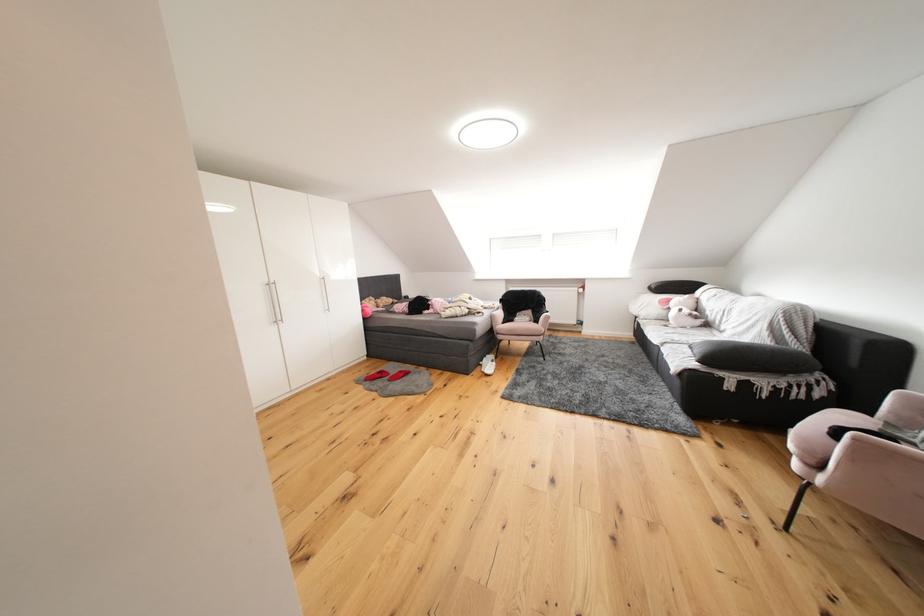
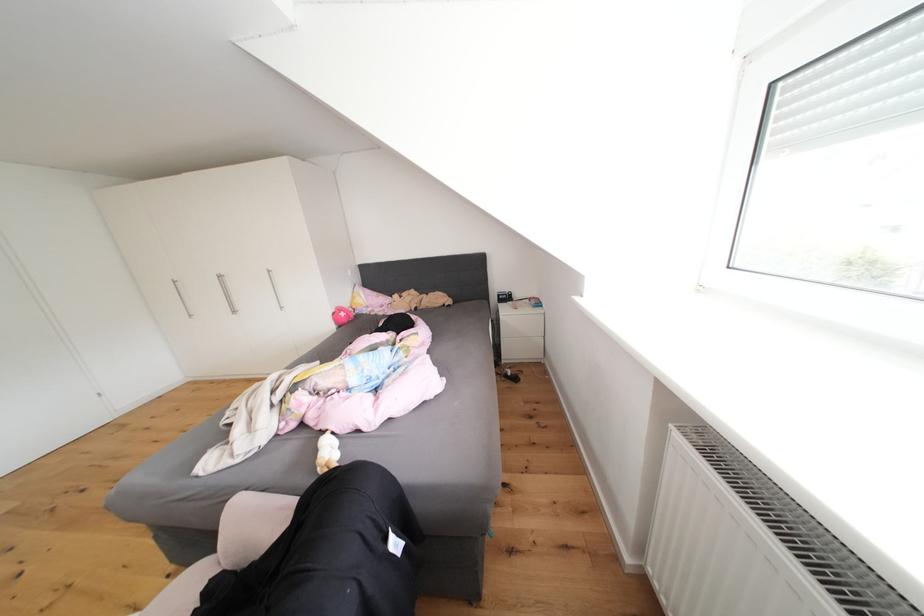
In the second image, find the point that corresponds to the point at 371,314 in the first image.

(343, 318)